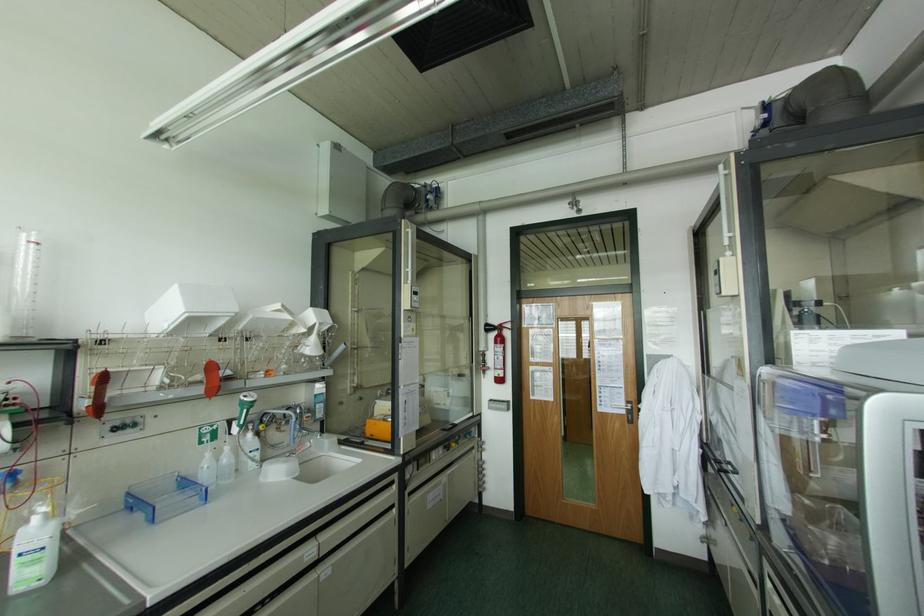
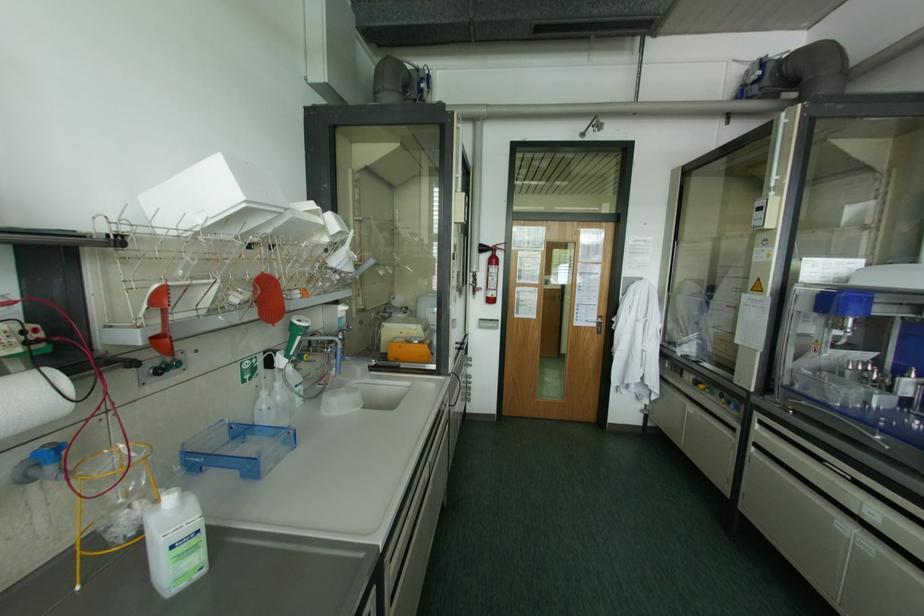
Question: Which direction would the cameraman need to move to produce the second image? Reply with the corresponding letter.

Choices:
 (A) Left
 (B) Right
 (C) Forward
 (D) Backward

Answer: (A)